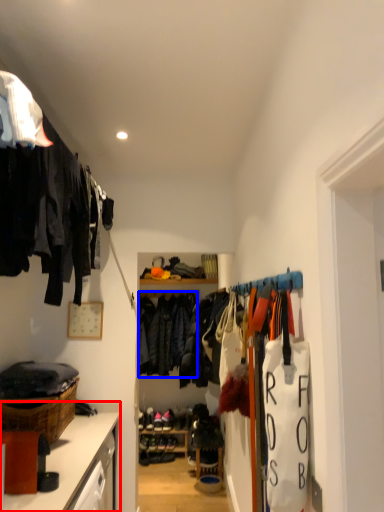
Question: Among these objects, which one is nearest to the camera, cabinetry (highlighted by a red box) or clothing (highlighted by a blue box)?

Choices:
 (A) cabinetry
 (B) clothing

Answer: (A)